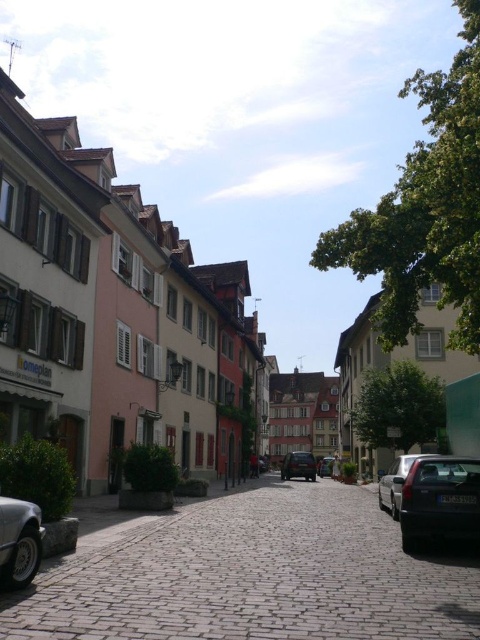
You are standing on the cobblestone street and want to take a photo of both the black car and the silver car. The black car is at point (x=269, y=506) and the silver car is at point (x=20, y=582). Since you want both cars in the frame, which car should you focus on to ensure both are in focus?

You should focus on the black car at point (x=269, y=506) because it is closer to the camera than the silver car at point (x=20, y=582). By focusing on the closer object, both cars will be in focus as the depth of field will cover the distance between them.

You are standing at the entrance of the brown cobblestone alley at center. If you walk straight ahead, what coordinates will you reach after moving 10 meters?

The coordinates after moving 10 meters straight ahead from the brown cobblestone alley at center would depend on the direction of the alley. Since the alley is at point (x=252, y=576), moving forward along its length would require knowing the alley orientation. Without additional information about the alley direction, it is impossible to determine the exact coordinates.